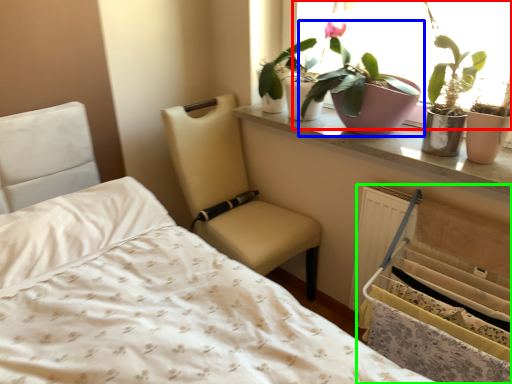
Question: Which object is the farthest from window (highlighted by a red box)? Choose among these: houseplant (highlighted by a blue box) or bed frame (highlighted by a green box).

Choices:
 (A) houseplant
 (B) bed frame

Answer: (B)